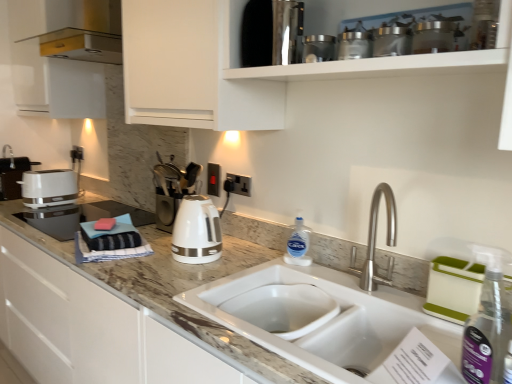
You are a GUI agent. You are given a task and a screenshot of the screen. Output one action in this format:
    pyautogui.click(x=<x>, y=<y>)
    Task: Click on the free space behind clear plastic bottle at sink, which is counted as the 2th bottle, starting from the right
    Image resolution: width=512 pixels, height=384 pixels.
    Given the screenshot: What is the action you would take?
    pyautogui.click(x=270, y=251)